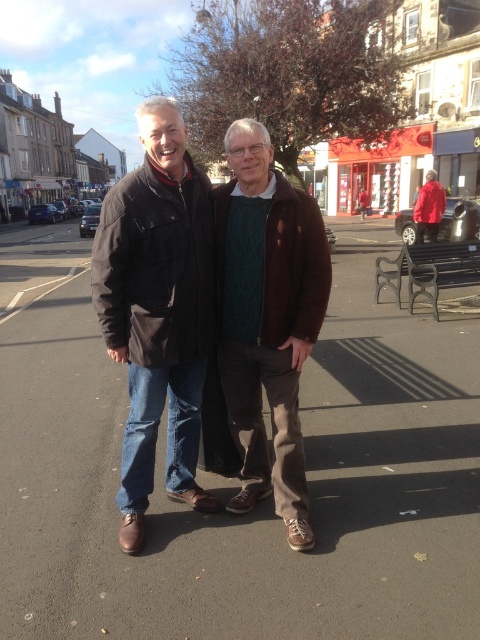
Question: Is dark brown leather jacket at center below brown suede jacket at center?

Choices:
 (A) no
 (B) yes

Answer: (A)

Question: Does dark brown leather jacket at center have a larger size compared to brown suede jacket at center?

Choices:
 (A) no
 (B) yes

Answer: (B)

Question: Is dark brown leather jacket at center below brown suede jacket at center?

Choices:
 (A) yes
 (B) no

Answer: (B)

Question: Which of the following is the closest to the observer?

Choices:
 (A) (153, 220)
 (B) (266, 481)

Answer: (A)